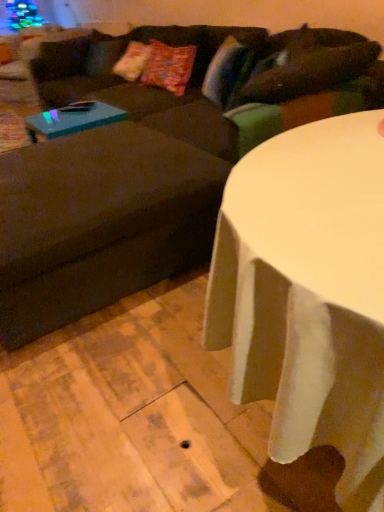
Question: From a real-world perspective, is teal glossy coffee table at left on top of white glossy table at center?

Choices:
 (A) no
 (B) yes

Answer: (A)

Question: Is white glossy table at center inside teal glossy coffee table at left?

Choices:
 (A) no
 (B) yes

Answer: (A)

Question: Can you confirm if teal glossy coffee table at left is thinner than white glossy table at center?

Choices:
 (A) yes
 (B) no

Answer: (A)

Question: Is teal glossy coffee table at left not close to white glossy table at center?

Choices:
 (A) yes
 (B) no

Answer: (A)

Question: Does teal glossy coffee table at left come in front of white glossy table at center?

Choices:
 (A) no
 (B) yes

Answer: (A)

Question: Is brown fabric swivel chair at left in front of or behind teal glossy coffee table at left in the image?

Choices:
 (A) behind
 (B) front

Answer: (B)

Question: Is brown fabric swivel chair at left situated inside teal glossy coffee table at left or outside?

Choices:
 (A) inside
 (B) outside

Answer: (B)

Question: Is point (173, 217) positioned closer to the camera than point (31, 129)?

Choices:
 (A) closer
 (B) farther

Answer: (A)

Question: Is brown fabric swivel chair at left bigger or smaller than teal glossy coffee table at left?

Choices:
 (A) big
 (B) small

Answer: (A)

Question: Is teal glossy coffee table at left to the left or to the right of dark brown fabric couch at upper center in the image?

Choices:
 (A) left
 (B) right

Answer: (A)

Question: Is teal glossy coffee table at left taller or shorter than dark brown fabric couch at upper center?

Choices:
 (A) short
 (B) tall

Answer: (A)

Question: Considering the positions of teal glossy coffee table at left and dark brown fabric couch at upper center in the image, is teal glossy coffee table at left bigger or smaller than dark brown fabric couch at upper center?

Choices:
 (A) small
 (B) big

Answer: (A)

Question: Do you think teal glossy coffee table at left is within dark brown fabric couch at upper center, or outside of it?

Choices:
 (A) inside
 (B) outside

Answer: (A)

Question: Which is correct: brown fabric swivel chair at left is inside dark brown fabric couch at upper center, or outside of it?

Choices:
 (A) inside
 (B) outside

Answer: (A)

Question: In terms of width, does brown fabric swivel chair at left look wider or thinner when compared to dark brown fabric couch at upper center?

Choices:
 (A) thin
 (B) wide

Answer: (A)